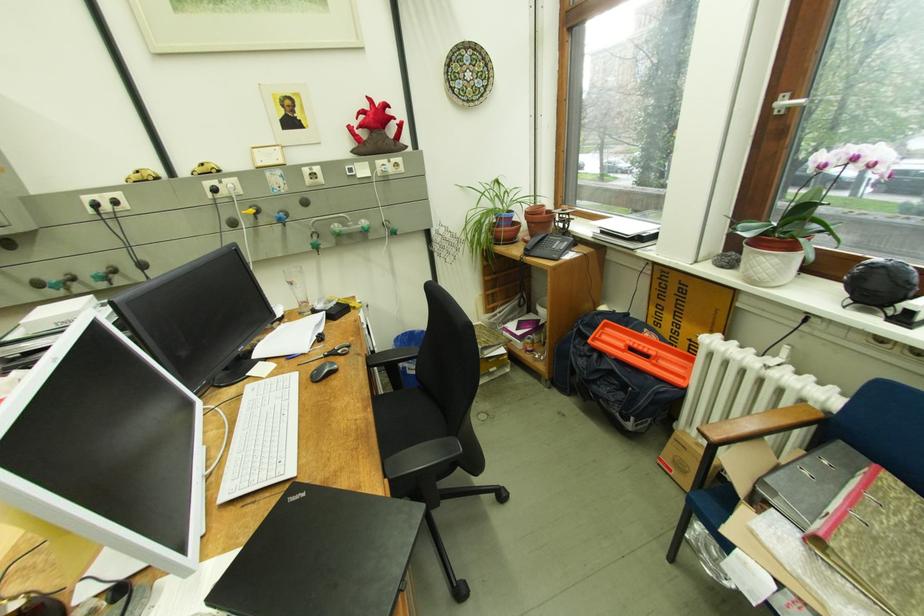
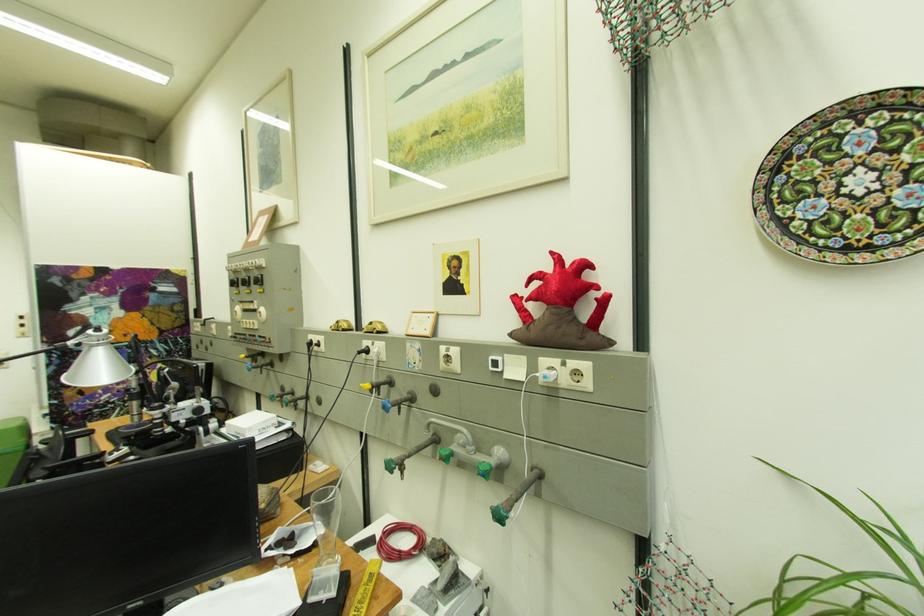
Find the pixel in the second image that matches [317,171] in the first image.

(454, 351)